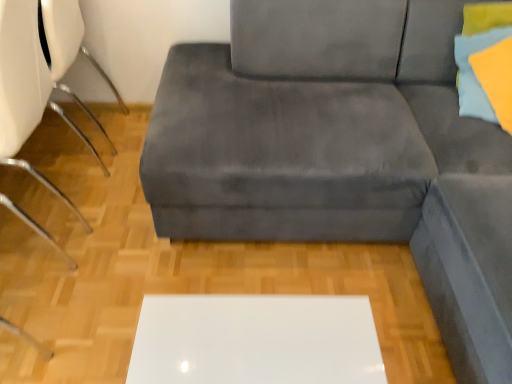
Where is `white plastic chair at left`? This screenshot has width=512, height=384. white plastic chair at left is located at coordinates (38, 77).

Based on the photo, in order to face matte yellow pillow at upper right, should I rotate leftwards or rightwards?

To align with it, rotate right about 31.852°.

You are a GUI agent. You are given a task and a screenshot of the screen. Output one action in this format:
    pyautogui.click(x=<x>, y=<y>)
    Task: Click on the white plastic chair at left
    The image size is (512, 384).
    Given the screenshot: What is the action you would take?
    pyautogui.click(x=38, y=77)

Is white plastic chair at left looking in the opposite direction of white plastic swivel chair at left?

A: No.

Is white plastic swivel chair at left a part of white plastic chair at left?

That's incorrect, white plastic swivel chair at left is not inside white plastic chair at left.

Is white plastic chair at left wider or thinner than white plastic swivel chair at left?

Clearly, white plastic chair at left has more width compared to white plastic swivel chair at left.

Which is closer to the camera, (21, 76) or (88, 52)?

Positioned in front is point (21, 76).

Is matte yellow pillow at upper right looking in the opposite direction of white plastic swivel chair at left?

matte yellow pillow at upper right does not have its back to white plastic swivel chair at left.

Does matte yellow pillow at upper right have a lesser width compared to white plastic swivel chair at left?

Yes.

Does point (499, 27) lie behind point (90, 147)?

That is False.

Is matte yellow pillow at upper right next to white plastic swivel chair at left?

No, matte yellow pillow at upper right is not next to white plastic swivel chair at left.

Looking at the image, does matte yellow pillow at upper right seem bigger or smaller compared to white glossy table at center?

matte yellow pillow at upper right is smaller than white glossy table at center.

What are the coordinates of `pillow above the white glossy table at center (from the image's perspective)` in the screenshot? It's located at (476, 73).

Considering the relative sizes of matte yellow pillow at upper right and white glossy table at center in the image provided, is matte yellow pillow at upper right wider than white glossy table at center?

Indeed, matte yellow pillow at upper right has a greater width compared to white glossy table at center.

Is matte yellow pillow at upper right positioned with its back to white glossy table at center?

No, white glossy table at center is not at the back of matte yellow pillow at upper right.

From a real-world perspective, is white glossy table at center below white plastic chair at left?

Yes, from a real-world perspective, white glossy table at center is below white plastic chair at left.

Is white glossy table at center not near white plastic chair at left?

They are positioned close to each other.

Is point (272, 295) farther from viewer compared to point (77, 41)?

That is False.

Considering the relative sizes of white glossy table at center and white plastic chair at left in the image provided, is white glossy table at center thinner than white plastic chair at left?

Yes, white glossy table at center is thinner than white plastic chair at left.

Is white plastic chair at left taller than matte yellow pillow at upper right?

Yes, white plastic chair at left is taller than matte yellow pillow at upper right.

Can you confirm if white plastic chair at left is bigger than matte yellow pillow at upper right?

Indeed, white plastic chair at left has a larger size compared to matte yellow pillow at upper right.

Can you tell me how much white plastic chair at left and matte yellow pillow at upper right differ in facing direction?

There is a 89.5-degree angle between the facing directions of white plastic chair at left and matte yellow pillow at upper right.

Does point (7, 90) come behind point (487, 106)?

No.

Are white glossy table at center and velvet gray couch at center located far from each other?

No, white glossy table at center is not far from velvet gray couch at center.

Is point (215, 379) positioned behind point (213, 187)?

No, it is in front of (213, 187).

Between white glossy table at center and velvet gray couch at center, which one has more height?

white glossy table at center is taller.

Considering the relative sizes of white glossy table at center and velvet gray couch at center in the image provided, is white glossy table at center bigger than velvet gray couch at center?

Actually, white glossy table at center might be smaller than velvet gray couch at center.

Is velvet gray couch at center wider than white plastic swivel chair at left?

Correct, the width of velvet gray couch at center exceeds that of white plastic swivel chair at left.

Does velvet gray couch at center have a lesser height compared to white plastic swivel chair at left?

Indeed, velvet gray couch at center has a lesser height compared to white plastic swivel chair at left.

Looking at this image, could you tell me if velvet gray couch at center is turned towards white plastic swivel chair at left?

No, velvet gray couch at center is not turned towards white plastic swivel chair at left.

This screenshot has height=384, width=512. I want to click on swivel chair below the white plastic chair at left (from a real-world perspective), so click(x=68, y=48).

Find the location of a particular element. Image resolution: width=512 pixels, height=384 pixels. pillow on the right of white plastic swivel chair at left is located at coordinates coord(476,73).

Based on their spatial positions, is matte yellow pillow at upper right or white plastic swivel chair at left further from white glossy table at center?

The object further to white glossy table at center is white plastic swivel chair at left.

Looking at the image, which one is located closer to white glossy table at center, velvet gray couch at center or white plastic swivel chair at left?

Based on the image, velvet gray couch at center appears to be nearer to white glossy table at center.

Based on their spatial positions, is velvet gray couch at center or matte yellow pillow at upper right closer to white plastic chair at left?

velvet gray couch at center.

Estimate the real-world distances between objects in this image. Which object is further from velvet gray couch at center, matte yellow pillow at upper right or white plastic swivel chair at left?

white plastic swivel chair at left is positioned further to the anchor velvet gray couch at center.

Estimate the real-world distances between objects in this image. Which object is closer to matte yellow pillow at upper right, white plastic chair at left or white plastic swivel chair at left?

Based on the image, white plastic chair at left appears to be nearer to matte yellow pillow at upper right.

In the scene shown: Which object lies nearer to the anchor point velvet gray couch at center, white plastic swivel chair at left or white plastic chair at left?

white plastic chair at left.

Estimate the real-world distances between objects in this image. Which object is further from white plastic swivel chair at left, white plastic chair at left or velvet gray couch at center?

The object further to white plastic swivel chair at left is velvet gray couch at center.

Considering their positions, is matte yellow pillow at upper right positioned closer to white plastic swivel chair at left than white glossy table at center?

white glossy table at center is positioned closer to the anchor white plastic swivel chair at left.

Image resolution: width=512 pixels, height=384 pixels. What are the coordinates of `studio couch located between white plastic chair at left and matte yellow pillow at upper right in the left-right direction` in the screenshot? It's located at (343, 153).

At what (x,y) coordinates should I click in order to perform the action: click on chair between white plastic swivel chair at left and white glossy table at center in the up-down direction. Please return your answer as a coordinate pair (x, y). The height and width of the screenshot is (384, 512). Looking at the image, I should click on (38, 77).

Locate an element on the screen. table located between velvet gray couch at center and matte yellow pillow at upper right in the left-right direction is located at coordinates (256, 340).

Where is `studio couch located between white plastic chair at left and white glossy table at center in the left-right direction`? The width and height of the screenshot is (512, 384). studio couch located between white plastic chair at left and white glossy table at center in the left-right direction is located at coordinates (343, 153).